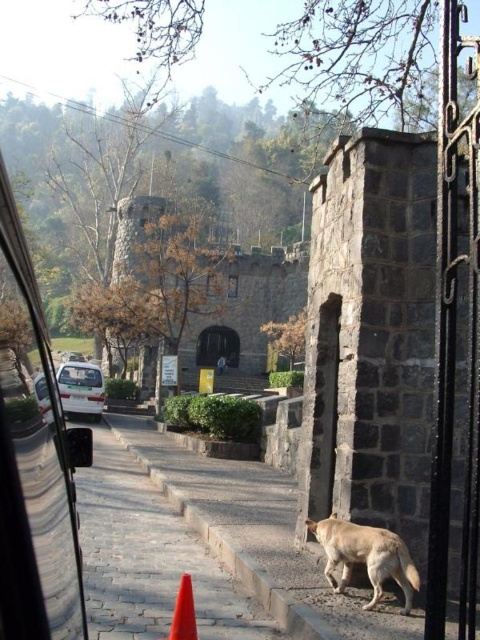
Between paved stone pavement at center and orange rubber traffic cone at lower center, which one has less height?

Standing shorter between the two is orange rubber traffic cone at lower center.

Does paved stone pavement at center have a smaller size compared to orange rubber traffic cone at lower center?

Incorrect, paved stone pavement at center is not smaller in size than orange rubber traffic cone at lower center.

Is point (377, 625) in front of point (177, 632)?

That is False.

Find the location of `paved stone pavement at center`. paved stone pavement at center is located at coordinates (250, 525).

Who is more forward, (16, 577) or (364, 556)?

Positioned in front is point (16, 577).

Is point (62, 470) positioned behind point (409, 557)?

No, it is in front of (409, 557).

Where is `transparent glass car window at left`? The width and height of the screenshot is (480, 640). transparent glass car window at left is located at coordinates (34, 460).

Identify the location of transparent glass car window at left. (34, 460).

Which is behind, point (200, 508) or point (414, 568)?

Positioned behind is point (200, 508).

Find the location of a particular element. This screenshot has height=640, width=480. paved stone pavement at center is located at coordinates (250, 525).